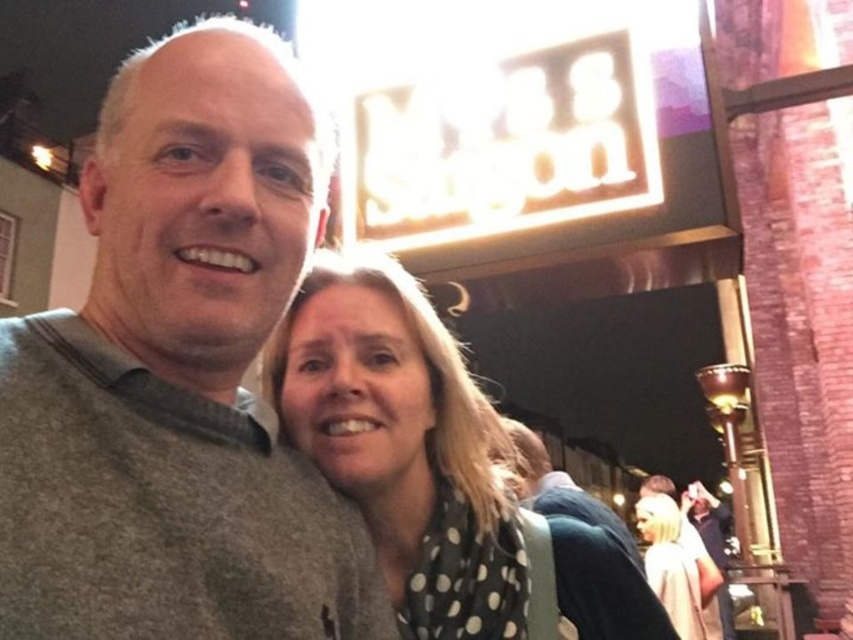
You are standing in the urban setting shown in the image. You want to move from the point at coordinates point (141, 388) to the point at coordinates point (676, 611). Is the path between them clear for walking?

The path between point (141, 388) and point (676, 611) is clear for walking since there are no obstacles mentioned in the scene description.

You are taking a selfie in a night setting with two people, a man in a gray sweater and a woman in a black top with white polka dots and a green backpack. You want to ensure the gray sweater at left is visible in the photo. Where should you position the camera relative to the point at coordinates (x=178, y=372)?

The gray sweater at left is located at point (x=178, y=372), so position the camera to include that coordinate in the frame to ensure visibility.